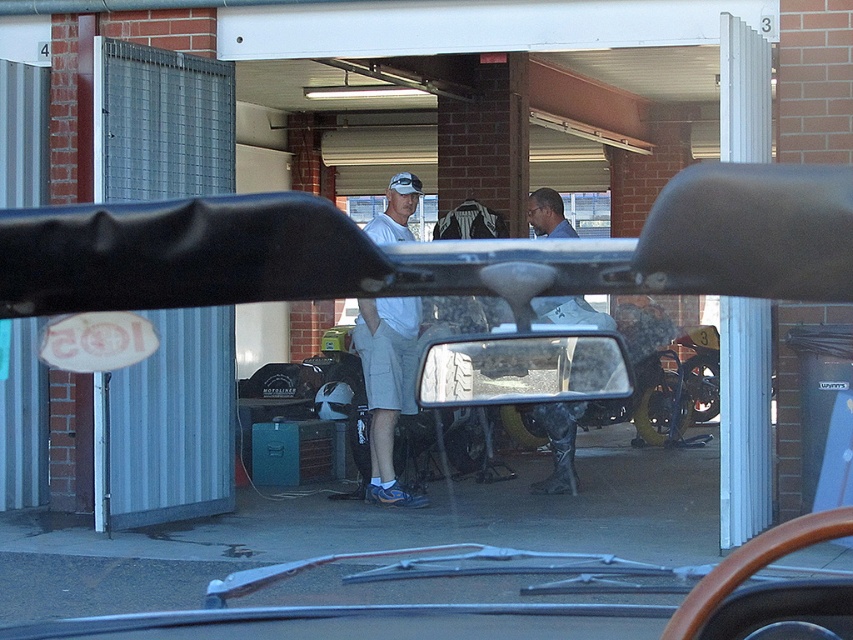
Who is shorter, metallic reflective mirror at center or dark gray rubber boots at center?

Standing shorter between the two is metallic reflective mirror at center.

Which is in front, point (494, 344) or point (546, 193)?

Point (494, 344)

What are the coordinates of `metallic reflective mirror at center` in the screenshot? It's located at tap(521, 369).

Is matte black motorcycle at center smaller than white matte shorts at center?

Yes.

Can you confirm if matte black motorcycle at center is positioned to the left of white matte shorts at center?

No, matte black motorcycle at center is not to the left of white matte shorts at center.

Between point (390, 250) and point (386, 380), which one is positioned behind?

Point (386, 380)

I want to click on matte black motorcycle at center, so (432, 250).

Can you confirm if white matte shorts at center is positioned to the left of white matte baseball cap at center?

Indeed, white matte shorts at center is positioned on the left side of white matte baseball cap at center.

Does point (405, 310) lie in front of point (392, 180)?

Yes, point (405, 310) is closer to viewer.

The height and width of the screenshot is (640, 853). I want to click on white matte shorts at center, so click(387, 385).